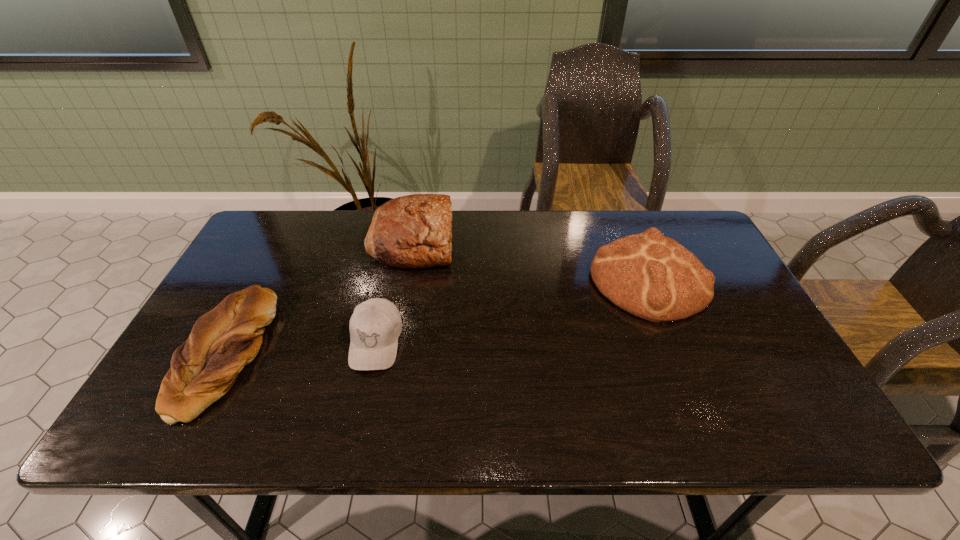
The width and height of the screenshot is (960, 540). What are the coordinates of `vacant space situated on the back of the leftmost bread` in the screenshot? It's located at (269, 266).

This screenshot has height=540, width=960. I want to click on object situated at the near edge, so click(224, 340).

What are the coordinates of `object at the left edge` in the screenshot? It's located at (224, 340).

This screenshot has height=540, width=960. What are the coordinates of `object located in the right edge section of the desktop` in the screenshot? It's located at (653, 277).

This screenshot has width=960, height=540. I want to click on object that is positioned at the near left corner, so [x=224, y=340].

The width and height of the screenshot is (960, 540). In order to click on object that is at the far right corner in this screenshot , I will do `click(653, 277)`.

In the image, there is a desktop. Find the location of `vacant area at the far edge`. vacant area at the far edge is located at coordinates (522, 238).

Identify the location of vacant area at the near edge of the desktop. This screenshot has width=960, height=540. (263, 440).

This screenshot has height=540, width=960. In order to click on free space at the right edge of the desktop in this screenshot , I will do `click(725, 369)`.

Identify the location of vacant area at the near right corner. (760, 408).